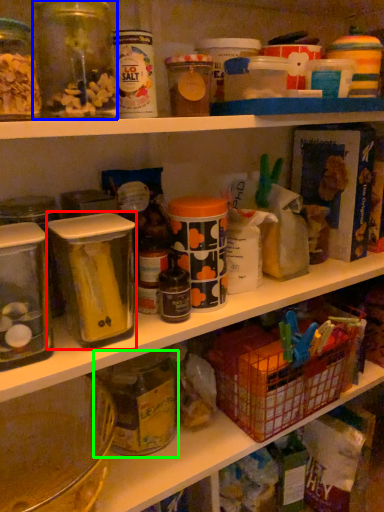
Question: Which object is the farthest from carton (highlighted by a red box)? Choose among these: glass jar (highlighted by a blue box) or glass jar (highlighted by a green box).

Choices:
 (A) glass jar
 (B) glass jar

Answer: (A)